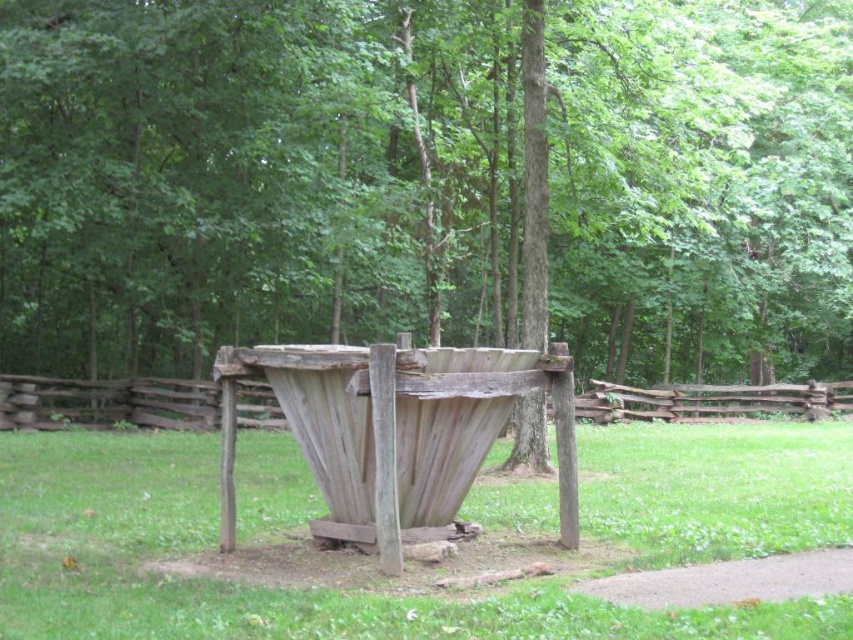
Question: Which of the following is the farthest from the observer?

Choices:
 (A) smooth brown tree trunk at center
 (B) weathered wood fence at center

Answer: (A)

Question: Does smooth brown tree trunk at center appear on the left side of weathered wood fence at center?

Choices:
 (A) yes
 (B) no

Answer: (A)

Question: Which object appears closest to the camera in this image?

Choices:
 (A) weathered wood fence at center
 (B) smooth brown tree trunk at center
 (C) green grass at center

Answer: (C)

Question: Is green grass at center to the left of weathered wood fence at center from the viewer's perspective?

Choices:
 (A) yes
 (B) no

Answer: (A)

Question: Which point is closer to the camera taking this photo?

Choices:
 (A) (618, 412)
 (B) (115, 605)
 (C) (606, 266)

Answer: (B)

Question: Does green grass at center appear under weathered wood fence at center?

Choices:
 (A) yes
 (B) no

Answer: (A)